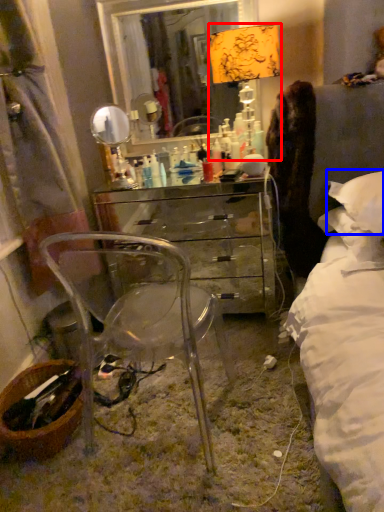
Question: Which object is further to the camera taking this photo, table lamp (highlighted by a red box) or pillow (highlighted by a blue box)?

Choices:
 (A) table lamp
 (B) pillow

Answer: (A)